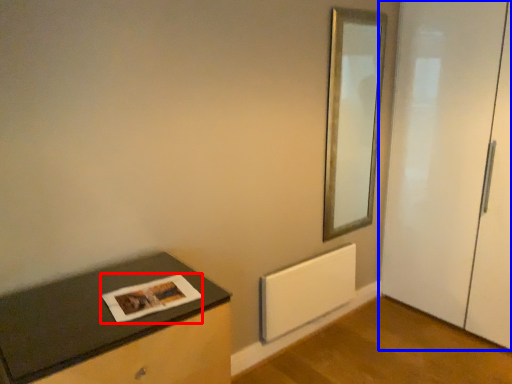
Question: Among these objects, which one is farthest to the camera, magazine (highlighted by a red box) or door (highlighted by a blue box)?

Choices:
 (A) magazine
 (B) door

Answer: (B)